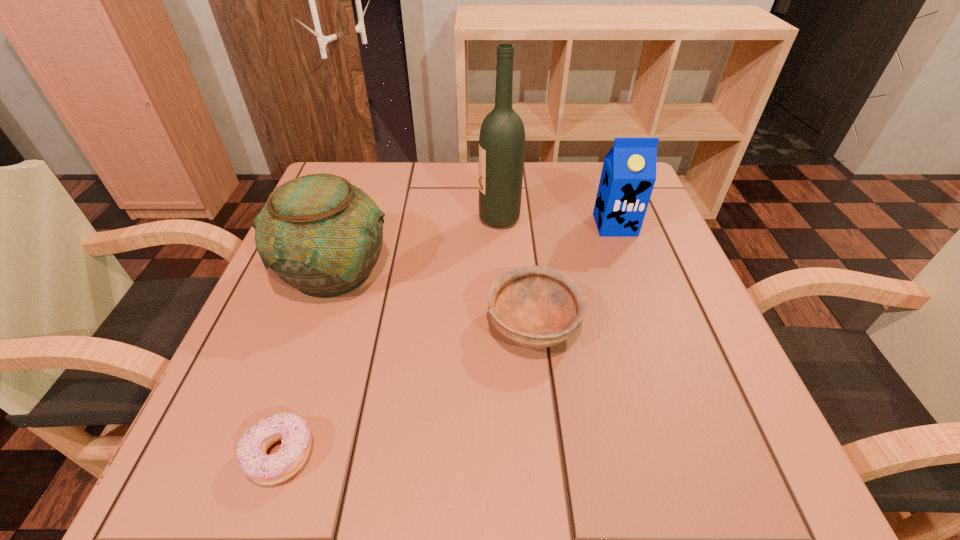
This screenshot has width=960, height=540. Identify the location of blank region between the pottery and the bowl. (434, 298).

The image size is (960, 540). I want to click on vacant space that is in between the shortest object and the carton, so click(x=448, y=340).

The height and width of the screenshot is (540, 960). Find the location of `vacant area that lies between the bowl and the carton`. vacant area that lies between the bowl and the carton is located at coordinates (574, 275).

At what (x,y) coordinates should I click in order to perform the action: click on unoccupied position between the wine bottle and the shortest object. Please return your answer as a coordinate pair (x, y). The image size is (960, 540). Looking at the image, I should click on (390, 337).

Identify the location of free area in between the doughnut and the tallest object. (390, 337).

The height and width of the screenshot is (540, 960). Find the location of `vacant area between the pottery and the tallest object`. vacant area between the pottery and the tallest object is located at coordinates (417, 245).

You are a GUI agent. You are given a task and a screenshot of the screen. Output one action in this format:
    pyautogui.click(x=<x>, y=<y>)
    Task: Click on the object that is the nearest to the tallest object
    This screenshot has height=540, width=960.
    Given the screenshot: What is the action you would take?
    pyautogui.click(x=628, y=176)

Image resolution: width=960 pixels, height=540 pixels. What are the coordinates of `object that is the fourth closest to the carton` in the screenshot? It's located at (293, 430).

Locate an element on the screen. The image size is (960, 540). vacant region that satisfies the following two spatial constraints: 1. on the labeled side of the tallest object; 2. on the front side of the shortest object is located at coordinates (512, 455).

Find the location of a particular element. The width and height of the screenshot is (960, 540). vacant space that satisfies the following two spatial constraints: 1. on the labeled side of the wine bottle; 2. on the front side of the pottery is located at coordinates (502, 271).